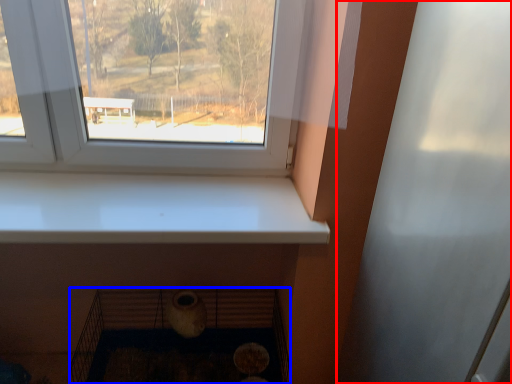
Question: Which of the following is the closest to the observer, screen door (highlighted by a red box) or shelf (highlighted by a blue box)?

Choices:
 (A) screen door
 (B) shelf

Answer: (A)